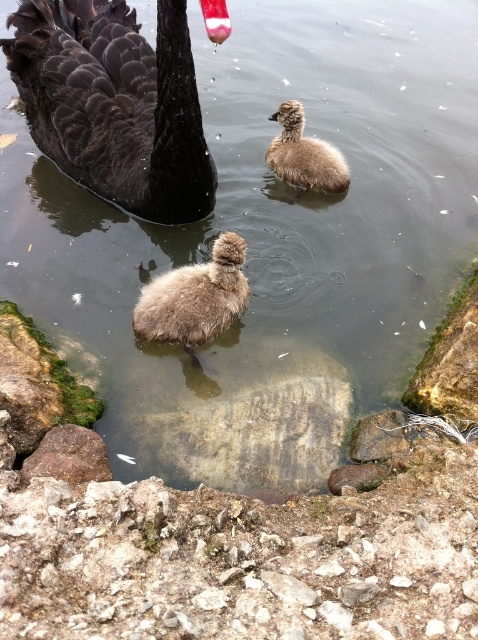
You are a wildlife photographer trying to capture a closeup of both the fuzzy brown duckling at center and the brown fluffy duckling at center. Since your camera has a fixed focus range, you need to know which duckling is wider to adjust the lens properly. Which one has a greater width?

The fuzzy brown duckling at center has a greater width than the brown fluffy duckling at center according to the description.

You are a photographer trying to capture a photo of the shiny black swan at upper left and the fuzzy brown duckling at center. Based on their positions, which one is located to the left of the other?

The shiny black swan at upper left is positioned on the left side of the fuzzy brown duckling at center, so the shiny black swan at upper left is to the left of the fuzzy brown duckling at center.

You are a photographer trying to capture the shiny black swan at upper left. You see a point at coordinate (115, 102). Is this point the location of the shiny black swan at upper left?

Yes, the shiny black swan at upper left is represented by point (115, 102).